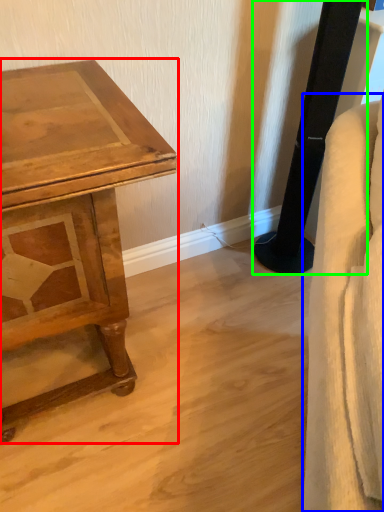
Question: Estimate the real-world distances between objects in this image. Which object is farther from table (highlighted by a red box), swivel chair (highlighted by a blue box) or pillar (highlighted by a green box)?

Choices:
 (A) swivel chair
 (B) pillar

Answer: (B)